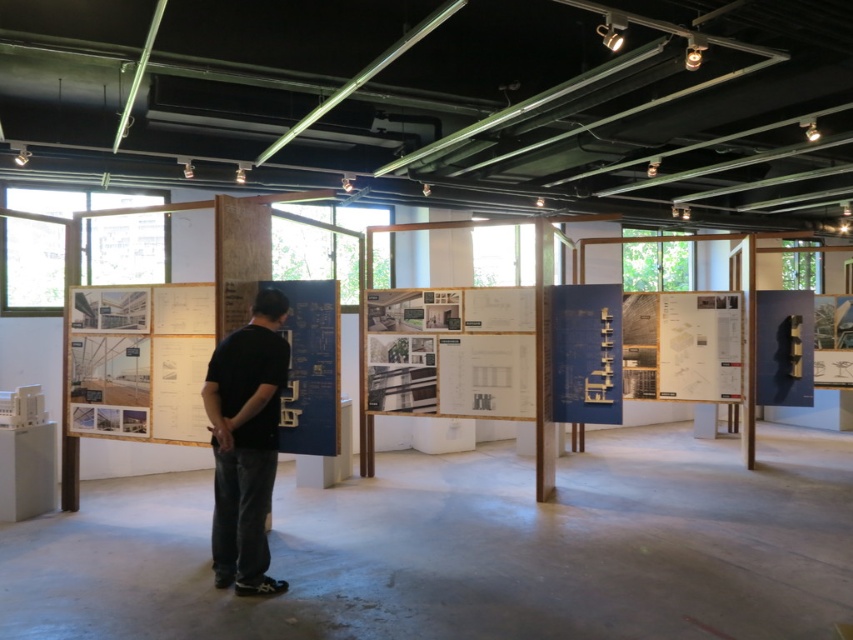
Question: Considering the relative positions of white paperboard at center and matte paper poster at center in the image provided, where is white paperboard at center located with respect to matte paper poster at center?

Choices:
 (A) left
 (B) right

Answer: (A)

Question: Which object is farther from the camera taking this photo?

Choices:
 (A) white paperboard at center
 (B) black cotton shirt at center

Answer: (A)

Question: Does white paperboard at center lie in front of black cotton shirt at center?

Choices:
 (A) no
 (B) yes

Answer: (A)

Question: Among these points, which one is farthest from the camera?

Choices:
 (A) (221, 394)
 (B) (596, 332)

Answer: (B)

Question: Which of the following is the farthest from the observer?

Choices:
 (A) matte paper poster at right
 (B) matte blue poster at center
 (C) white paperboard at center

Answer: (A)

Question: Observing the image, what is the correct spatial positioning of white paperboard at center in reference to matte paper poster at center?

Choices:
 (A) above
 (B) below

Answer: (B)